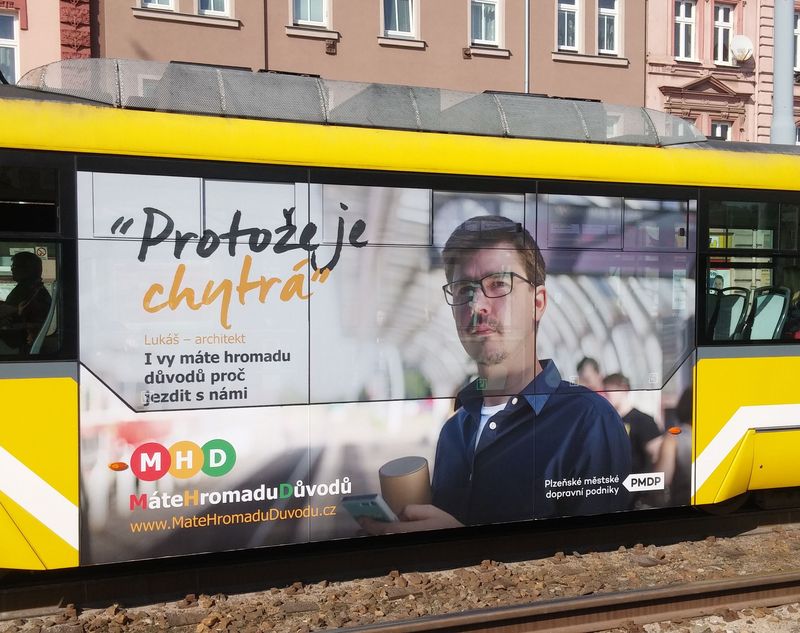
I want to click on corners, so click(77, 172), click(138, 4), click(618, 54), click(414, 34), click(689, 499), click(81, 561), click(70, 373), click(54, 204), click(694, 199), click(730, 123).